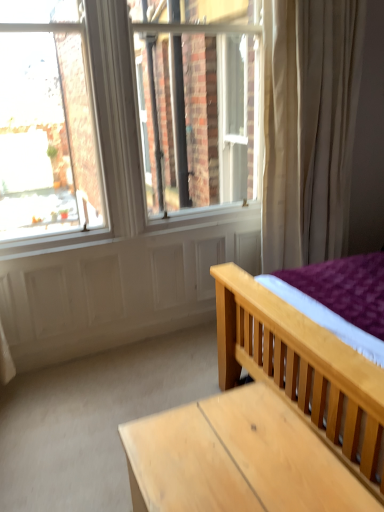
Describe the element at coordinates (303, 370) in the screenshot. I see `light wood bed at center` at that location.

At what (x,y) coordinates should I click in order to perform the action: click on light wood bed at center. Please return your answer as a coordinate pair (x, y). This screenshot has height=512, width=384. Looking at the image, I should click on 303,370.

Describe the element at coordinates (236, 459) in the screenshot. I see `light brown wooden table at lower right` at that location.

Measure the distance between light brown wooden table at lower right and camera.

The depth of light brown wooden table at lower right is 1.08 meters.

What is the approximate width of light brown wooden table at lower right?

56.69 centimeters.

You are a GUI agent. You are given a task and a screenshot of the screen. Output one action in this format:
    pyautogui.click(x=<x>, y=<y>)
    Task: Click on the light brown wooden table at lower right
    The width and height of the screenshot is (384, 512).
    Given the screenshot: What is the action you would take?
    pyautogui.click(x=236, y=459)

Where is `light wood bed at center`? The height and width of the screenshot is (512, 384). light wood bed at center is located at coordinates (303, 370).

Is light wood bed at center at the left side of light brown wooden table at lower right?

In fact, light wood bed at center is to the right of light brown wooden table at lower right.

From the picture: Considering their positions, is light wood bed at center located in front of or behind light brown wooden table at lower right?

Clearly, light wood bed at center is in front of light brown wooden table at lower right.

Is point (356, 385) in front of point (142, 485)?

No, (356, 385) is further to viewer.

From the image's perspective, between light wood bed at center and light brown wooden table at lower right, who is located below?

light brown wooden table at lower right.

Looking at this image, from a real-world perspective, is light wood bed at center positioned above or below light brown wooden table at lower right?

light wood bed at center is situated higher than light brown wooden table at lower right in the real world.

Can you confirm if light wood bed at center is wider than light brown wooden table at lower right?

Correct, the width of light wood bed at center exceeds that of light brown wooden table at lower right.

Can you confirm if light wood bed at center is taller than light brown wooden table at lower right?

Yes.

Considering the relative sizes of light wood bed at center and light brown wooden table at lower right in the image provided, is light wood bed at center smaller than light brown wooden table at lower right?

No, light wood bed at center is not smaller than light brown wooden table at lower right.

Is light wood bed at center not inside light brown wooden table at lower right?

Yes, light wood bed at center is outside of light brown wooden table at lower right.

Is light wood bed at center with light brown wooden table at lower right?

light wood bed at center and light brown wooden table at lower right are clearly separated.

Could you tell me if light wood bed at center is turned towards light brown wooden table at lower right?

Yes, light wood bed at center is turned towards light brown wooden table at lower right.

Identify the location of bed positioned vertically above the light brown wooden table at lower right (from a real-world perspective). This screenshot has height=512, width=384. (303, 370).

Considering the relative positions of light brown wooden table at lower right and light wood bed at center in the image provided, is light brown wooden table at lower right to the left or to the right of light wood bed at center?

Based on their positions, light brown wooden table at lower right is located to the left of light wood bed at center.

Which object is further away from the camera, light brown wooden table at lower right or light wood bed at center?

light brown wooden table at lower right.

Considering the positions of point (169, 488) and point (296, 404), is point (169, 488) closer or farther from the camera than point (296, 404)?

Point (169, 488) is closer to the camera than point (296, 404).

From the image's perspective, does light brown wooden table at lower right appear lower than light wood bed at center?

Indeed, from the image's perspective, light brown wooden table at lower right is shown beneath light wood bed at center.

From a real-world perspective, does light brown wooden table at lower right stand above light wood bed at center?

No, from a real-world perspective, light brown wooden table at lower right is not on top of light wood bed at center.

Does light brown wooden table at lower right have a lesser width compared to light wood bed at center?

Yes, light brown wooden table at lower right is thinner than light wood bed at center.

Considering the sizes of light brown wooden table at lower right and light wood bed at center in the image, is light brown wooden table at lower right taller or shorter than light wood bed at center?

In the image, light brown wooden table at lower right appears to be shorter than light wood bed at center.

Between light brown wooden table at lower right and light wood bed at center, which one has larger size?

Bigger between the two is light wood bed at center.

Is light brown wooden table at lower right spatially inside light wood bed at center, or outside of it?

light brown wooden table at lower right lies outside light wood bed at center.

Are light brown wooden table at lower right and light wood bed at center far apart?

light brown wooden table at lower right is actually quite close to light wood bed at center.

Could you tell me if light brown wooden table at lower right is facing light wood bed at center?

No.

Find the location of `bed in front of the light brown wooden table at lower right`. bed in front of the light brown wooden table at lower right is located at coordinates (303, 370).

Locate an element on the screen. The width and height of the screenshot is (384, 512). bed that appears above the light brown wooden table at lower right (from the image's perspective) is located at coordinates (303, 370).

Identify the location of table below the light wood bed at center (from the image's perspective). Image resolution: width=384 pixels, height=512 pixels. (236, 459).